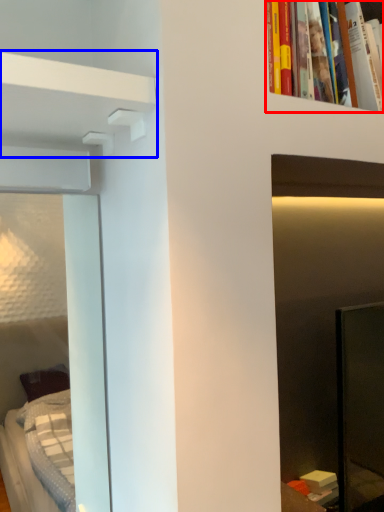
Question: Which object is closer to the camera taking this photo, book (highlighted by a red box) or shelf (highlighted by a blue box)?

Choices:
 (A) book
 (B) shelf

Answer: (B)